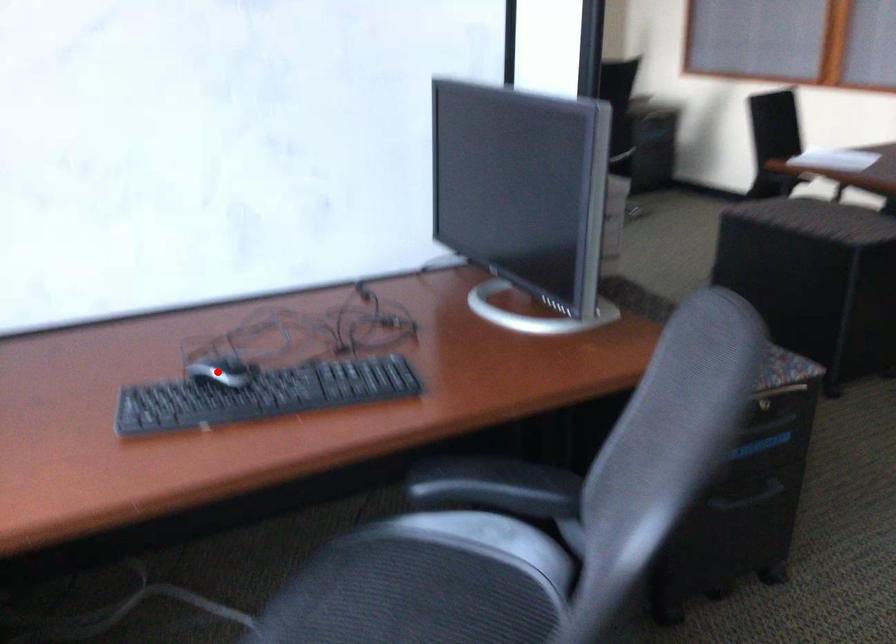
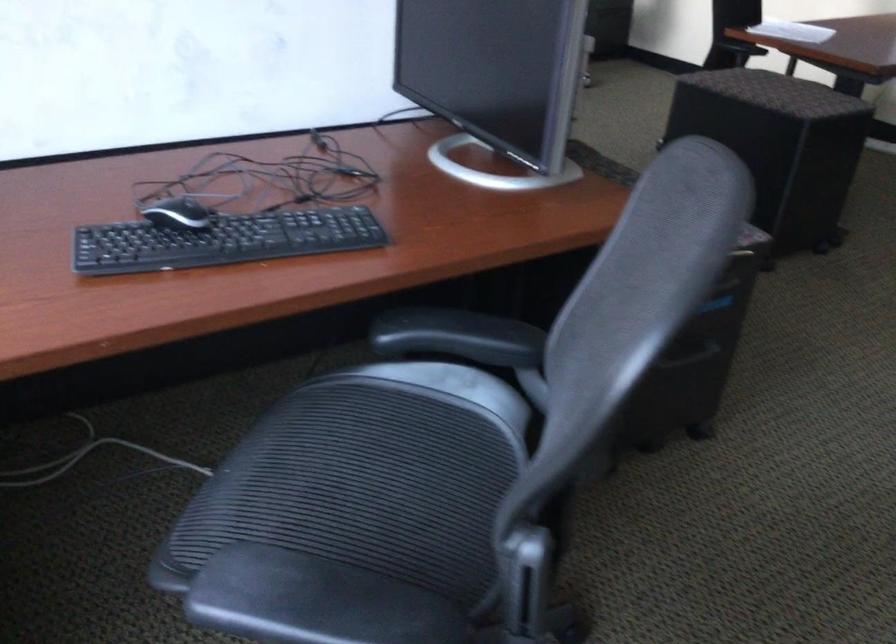
Find the pixel in the second image that matches the highlighted location in the first image.

(177, 214)